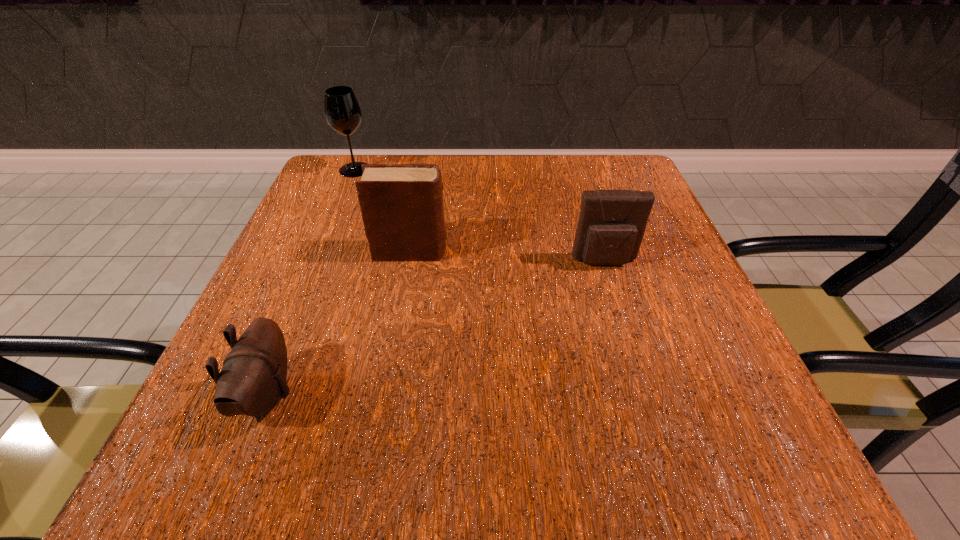
The width and height of the screenshot is (960, 540). What are the coordinates of `vacant area that lies between the nearer pouch and the rightmost object` in the screenshot? It's located at (436, 328).

You are a GUI agent. You are given a task and a screenshot of the screen. Output one action in this format:
    pyautogui.click(x=<x>, y=<y>)
    Task: Click on the object identified as the closest to the nearer pouch
    
    Given the screenshot: What is the action you would take?
    pyautogui.click(x=402, y=209)

Locate which object is the closest to the diary. Please provide its 2D coordinates. Your answer should be formatted as a tuple, i.e. [(x, y)], where the tuple contains the x and y coordinates of a point satisfying the conditions above.

[(252, 380)]

Where is `vacant area in the image that satisfies the following two spatial constraints: 1. with an open flap on the farther pouch; 2. with the flap open on the left pouch`? Image resolution: width=960 pixels, height=540 pixels. vacant area in the image that satisfies the following two spatial constraints: 1. with an open flap on the farther pouch; 2. with the flap open on the left pouch is located at coordinates (646, 394).

This screenshot has height=540, width=960. I want to click on free space that satisfies the following two spatial constraints: 1. with an open flap on the right pouch; 2. with the flap open on the nearer pouch, so click(646, 394).

Where is `vacant space that satisfies the following two spatial constraints: 1. with an open flap on the rightmost object; 2. with the flap open on the nearest object`? This screenshot has height=540, width=960. vacant space that satisfies the following two spatial constraints: 1. with an open flap on the rightmost object; 2. with the flap open on the nearest object is located at coordinates (646, 394).